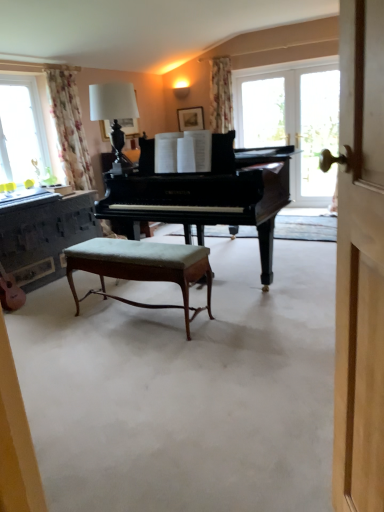
Question: Can you confirm if floral fabric curtain at left is taller than wooden dresser at left?

Choices:
 (A) yes
 (B) no

Answer: (A)

Question: Is floral fabric curtain at left outside wooden dresser at left?

Choices:
 (A) no
 (B) yes

Answer: (B)

Question: Can you confirm if floral fabric curtain at left is shorter than wooden dresser at left?

Choices:
 (A) yes
 (B) no

Answer: (B)

Question: Is floral fabric curtain at left at the right side of wooden dresser at left?

Choices:
 (A) no
 (B) yes

Answer: (B)

Question: From a real-world perspective, is floral fabric curtain at left on wooden dresser at left?

Choices:
 (A) no
 (B) yes

Answer: (B)

Question: Does floral fabric curtain at left have a lesser width compared to wooden dresser at left?

Choices:
 (A) no
 (B) yes

Answer: (B)

Question: Could wooden stool at center be considered to be inside wooden picture frame at upper center?

Choices:
 (A) yes
 (B) no

Answer: (B)

Question: Is wooden picture frame at upper center positioned behind wooden stool at center?

Choices:
 (A) no
 (B) yes

Answer: (B)

Question: Can you confirm if wooden picture frame at upper center is taller than wooden stool at center?

Choices:
 (A) yes
 (B) no

Answer: (A)

Question: Does wooden picture frame at upper center appear on the right side of wooden stool at center?

Choices:
 (A) no
 (B) yes

Answer: (A)

Question: From a real-world perspective, does wooden picture frame at upper center sit lower than wooden stool at center?

Choices:
 (A) no
 (B) yes

Answer: (A)

Question: Is wooden picture frame at upper center in contact with wooden stool at center?

Choices:
 (A) no
 (B) yes

Answer: (A)

Question: Is transparent glass door at right in front of wooden stool at center?

Choices:
 (A) no
 (B) yes

Answer: (A)